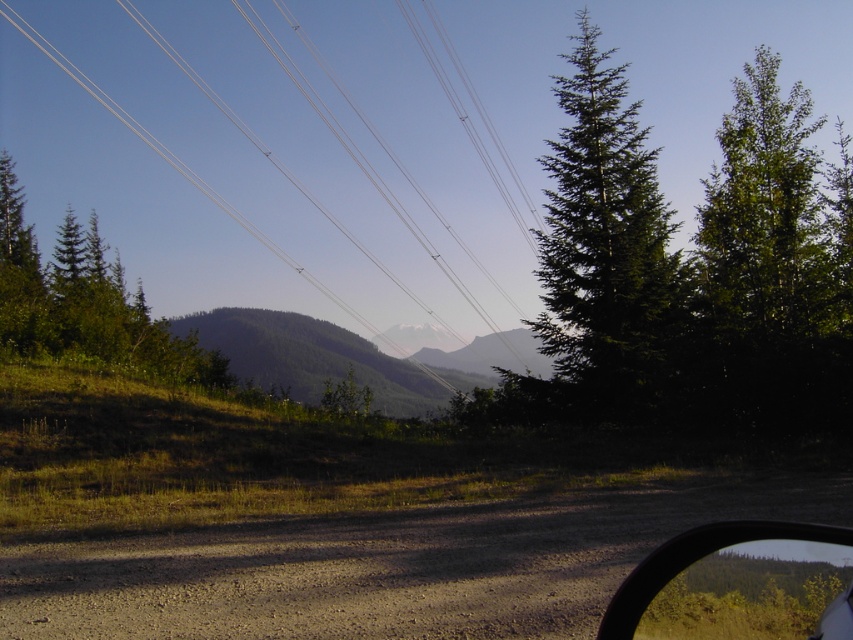
You are riding a motorcycle on the dirt road and notice a white wire at upper center. According to the coordinates given by point [346,134], where exactly is the white wire located in relation to your current position while riding?

The white wire at upper center is located at coordinates point [346,134], which places it in the upper center of the image, meaning it is ahead and slightly above your current line of sight while riding the motorcycle.